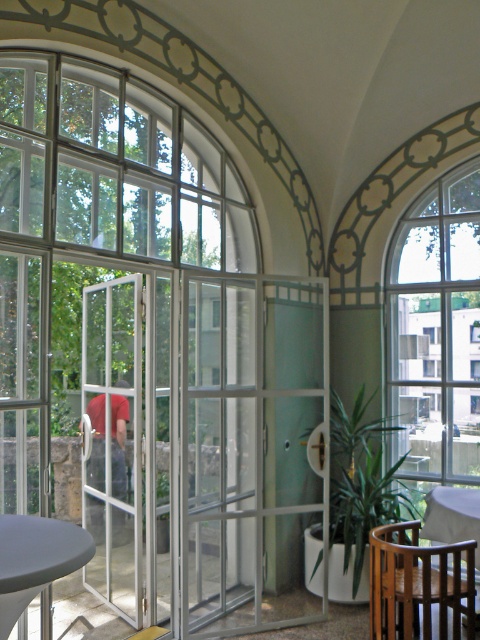
You are standing in the room and want to exit through the white glass door at center. Based on the coordinates provided, can you determine if the door is located near the French doors leading to the patio?

The white glass door at center is located at coordinates point (x=113, y=442). Since the French doors are in the foreground near the arches and the coordinates indicate the white glass door at center is positioned further back in the room, the door is not near the French doors leading to the patio.

You are standing in the interior space and want to exit through the clear glass window at right. Considering the distance from where you are standing to the window is 15.73 feet, can you walk straight to it without any obstacles?

The clear glass window at right is 15.73 feet away from the camera, so yes, you can walk straight to it as there are no obstacles mentioned in the scene description.

Based on the photo, you are sitting on the mahogany wood chair at lower right and want to look through the clear glass window at right. Can you see the window from your current position?

The clear glass window at right is located above the mahogany wood chair at lower right, so yes, you can see the window from your current position by looking upward.